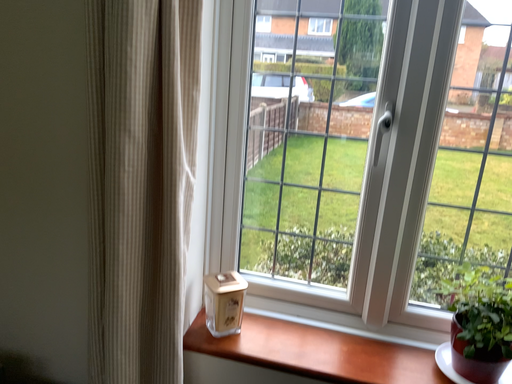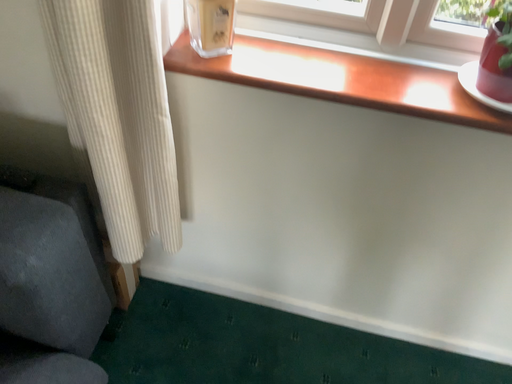
Question: Which way did the camera rotate in the video?

Choices:
 (A) rotated upward
 (B) rotated downward

Answer: (B)